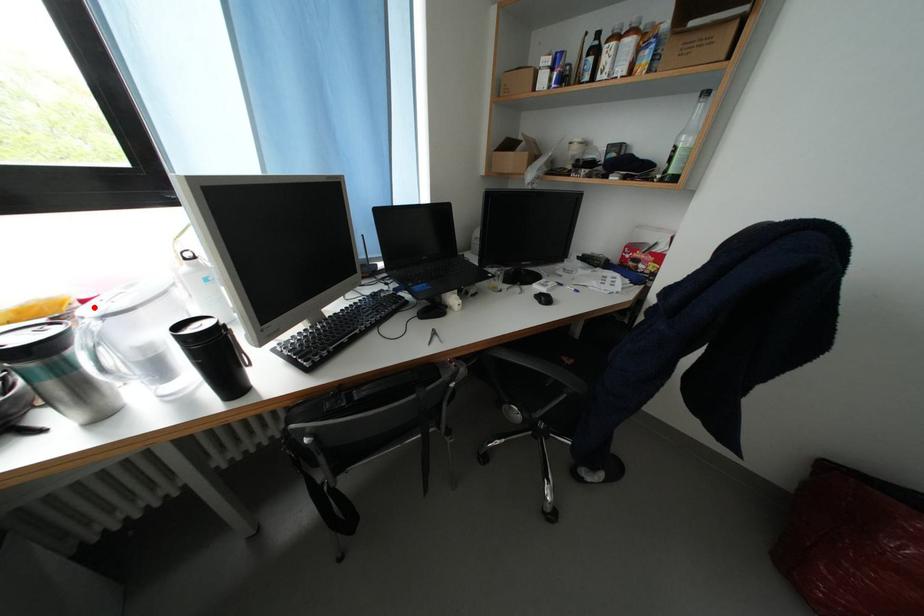
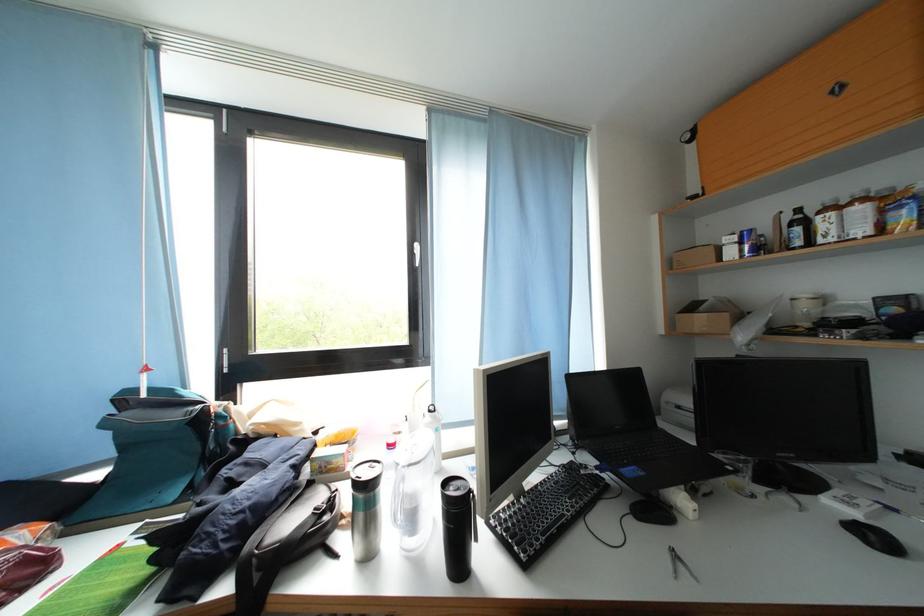
Find the pixel in the second image that matches the highlighted location in the first image.

(398, 451)